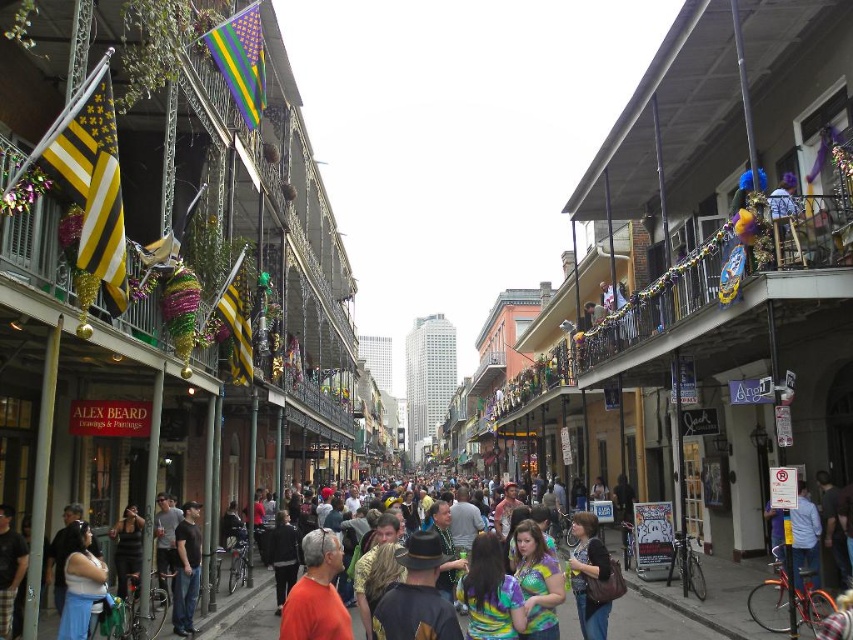
Can you confirm if denim jeans at center is shorter than dark gray shirt at center?

No, denim jeans at center is not shorter than dark gray shirt at center.

Does denim jeans at center appear on the right side of dark gray shirt at center?

Yes, denim jeans at center is to the right of dark gray shirt at center.

Locate an element on the screen. This screenshot has width=853, height=640. denim jeans at center is located at coordinates (589, 576).

Between orange t-shirt at center and denim jeans at center, which one appears on the left side from the viewer's perspective?

From the viewer's perspective, orange t-shirt at center appears more on the left side.

Can you confirm if orange t-shirt at center is thinner than denim jeans at center?

No.

This screenshot has height=640, width=853. I want to click on orange t-shirt at center, so click(x=316, y=593).

Who is more forward, (326, 630) or (189, 504)?

Positioned in front is point (326, 630).

This screenshot has width=853, height=640. What do you see at coordinates (316, 593) in the screenshot? I see `orange t-shirt at center` at bounding box center [316, 593].

At what (x,y) coordinates should I click in order to perform the action: click on orange t-shirt at center. Please return your answer as a coordinate pair (x, y). This screenshot has height=640, width=853. Looking at the image, I should click on (316, 593).